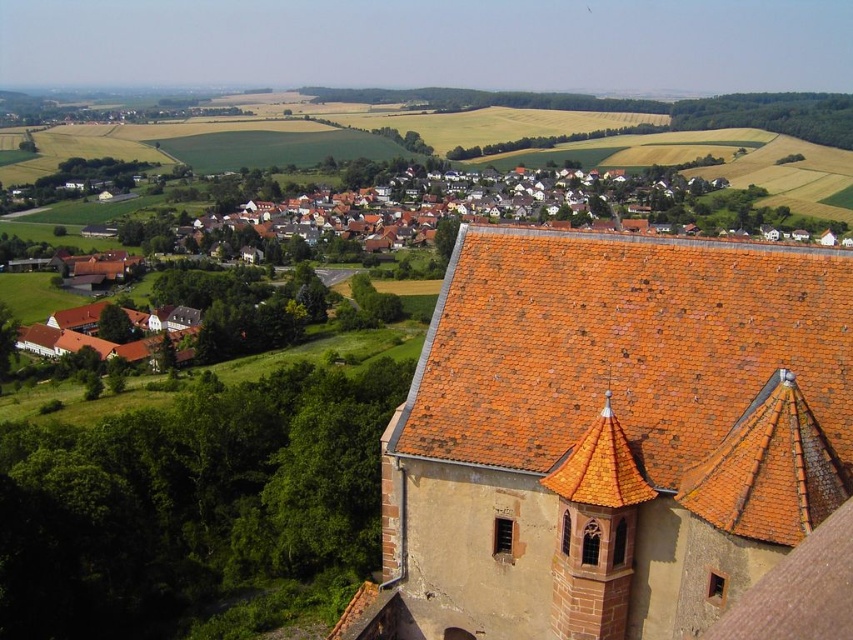
Question: Can you confirm if orange clay tiles at upper right is positioned below orange tiled tower at upper right?

Choices:
 (A) no
 (B) yes

Answer: (A)

Question: Observing the image, what is the correct spatial positioning of orange clay tiles at upper right in reference to orange tiled tower at upper right?

Choices:
 (A) left
 (B) right

Answer: (B)

Question: Which object is closer to the camera taking this photo?

Choices:
 (A) orange clay tiles at upper right
 (B) orange tiled tower at upper right

Answer: (A)

Question: Considering the relative positions of orange clay tiles at upper right and orange tiled tower at upper right in the image provided, where is orange clay tiles at upper right located with respect to orange tiled tower at upper right?

Choices:
 (A) left
 (B) right

Answer: (B)